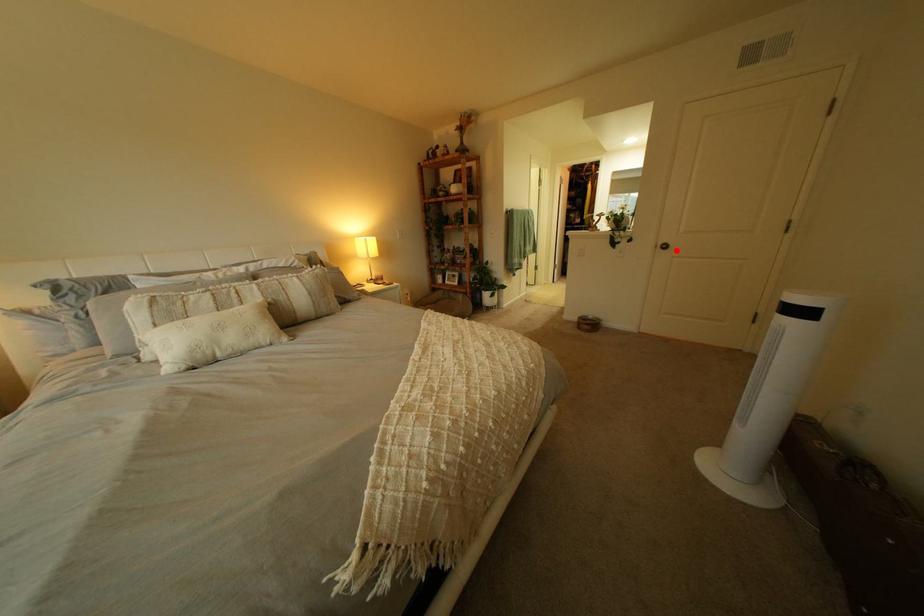
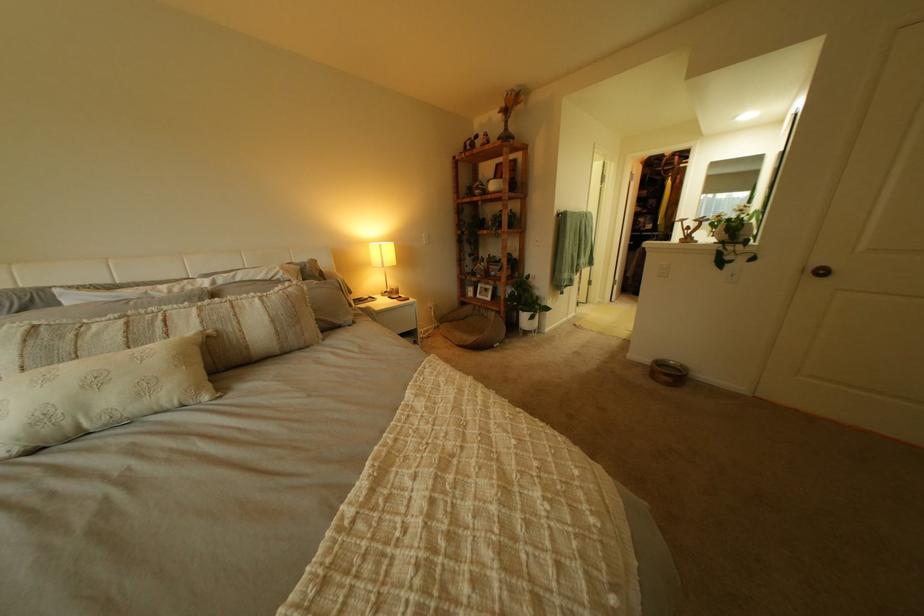
Locate, in the second image, the point that corresponds to the highlighted location in the first image.

(825, 276)